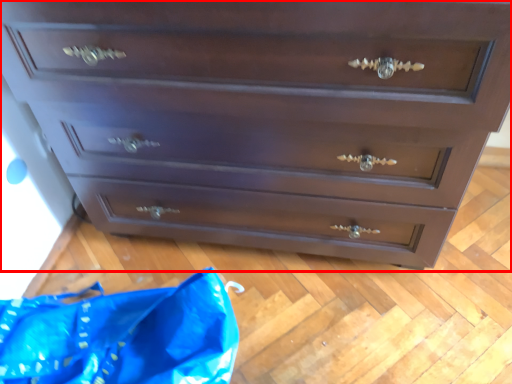
Question: From the image's perspective, what is the correct spatial relationship of chest of drawers (annotated by the red box) in relation to material?

Choices:
 (A) below
 (B) above

Answer: (B)